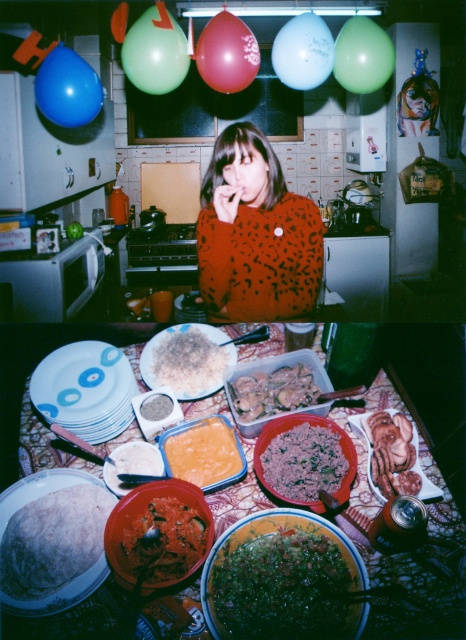
You are planning to decorate a party and need to choose between the blue rubber balloon at upper left and the red rubber balloon at upper center. Which balloon is wider?

The blue rubber balloon at upper left is wider than the red rubber balloon at upper center.

You are standing in a kitchen and see a green matte balloon at upper left. If you want to reach it, will you be able to do so without any assistance?

The green matte balloon at upper left is 2.14 meters away from viewer, which is beyond typical human reach without assistance. You would need a ladder or a tool to reach it.

You are a chef preparing a meal and notice the leopard print sweater at center and the smooth brown meat at center on the counter. Which item is closer to you, the chef, in this kitchen scene?

The leopard print sweater at center is closer to you because it is positioned over the smooth brown meat at center, indicating it is in a higher or more forward position.